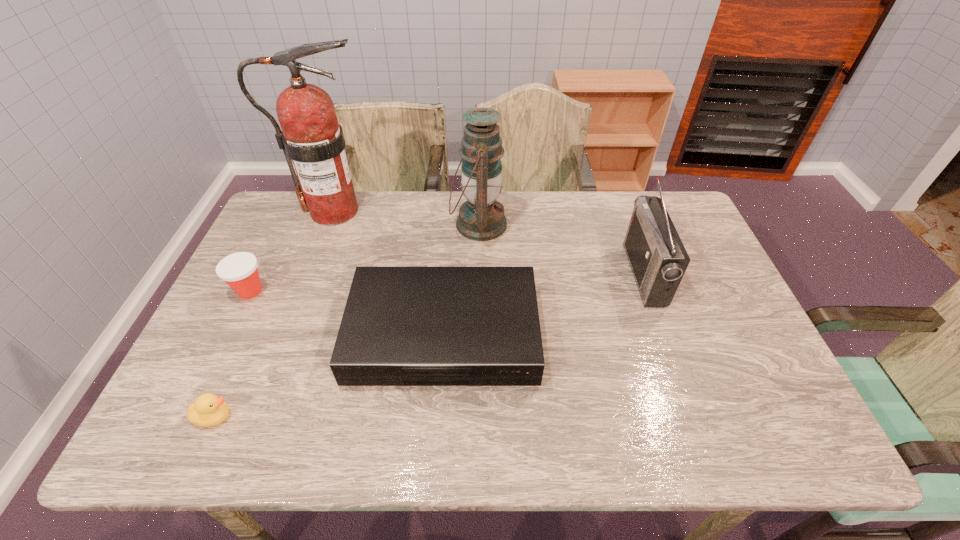
Find the location of `fire extinguisher`. fire extinguisher is located at coordinates (311, 136).

Image resolution: width=960 pixels, height=540 pixels. Identify the location of oil lamp. (481, 218).

Image resolution: width=960 pixels, height=540 pixels. I want to click on the rightmost object, so (658, 259).

The height and width of the screenshot is (540, 960). I want to click on the fourth shortest object, so click(x=658, y=259).

At what (x,y) coordinates should I click in order to perform the action: click on Dixie cup. Please return your answer as a coordinate pair (x, y). The image size is (960, 540). Looking at the image, I should click on (239, 270).

Image resolution: width=960 pixels, height=540 pixels. What are the coordinates of `CD player` in the screenshot? It's located at (402, 326).

The image size is (960, 540). I want to click on duckling, so click(x=208, y=410).

The width and height of the screenshot is (960, 540). In order to click on the nearest object in this screenshot , I will do `click(208, 410)`.

Locate an element on the screen. vacant space located at the nozzle of the fire extinguisher is located at coordinates (478, 211).

Find the location of a particular element. Image resolution: width=960 pixels, height=540 pixels. vacant area situated 0.110m on the right of the fifth shortest object is located at coordinates (540, 225).